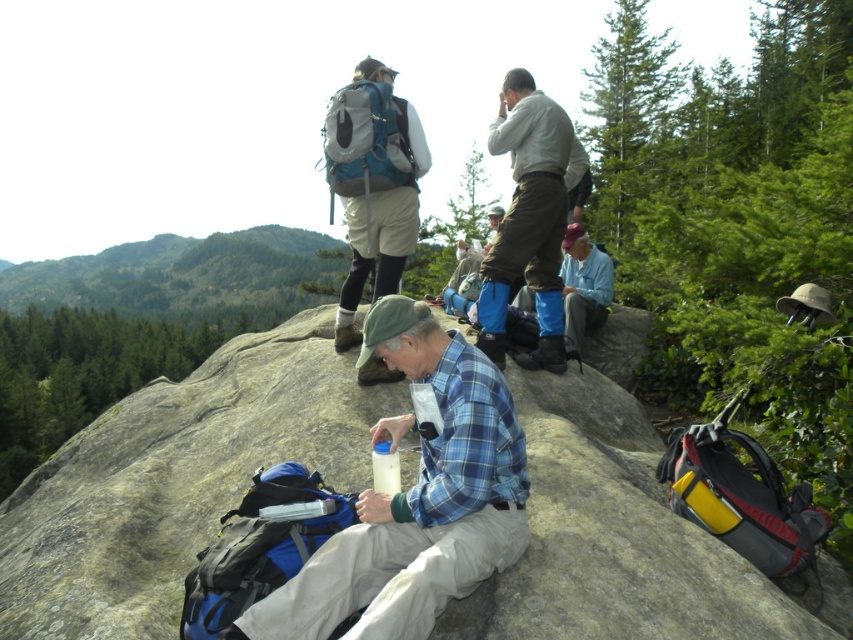
You are standing at the viewpoint looking at the rocky outcrop. There are two points marked on the image. One is at coordinates point (300, 611) and the other is at point (608, 260). Which point is closer to you?

Point (300, 611) is closer to the viewer than point (608, 260).

You are a hiker who wants to place your water bottle on a surface. Based on the scene, can you determine if the smooth gray rock at center is a suitable surface under the light blue flannel shirt at center to place your water bottle?

The smooth gray rock at center is positioned under the light blue flannel shirt at center, so placing the water bottle there would be stable as the rock provides a solid base beneath the shirt.

You are a hiker who wants to take a photo of the smooth gray rock at center and the matte gray shirt at upper center. Which object should you focus on first to ensure it appears sharp in the photo?

You should focus on the smooth gray rock at center first because it is closer to the viewer than the matte gray shirt at upper center, so focusing on the closer object will keep it sharp while the background may blur slightly.